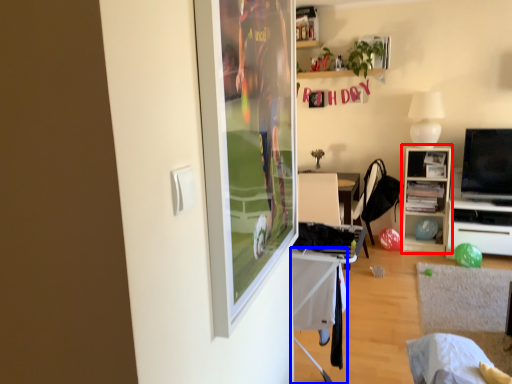
Question: Which of the following is the farthest to the observer, cabinetry (highlighted by a red box) or table (highlighted by a blue box)?

Choices:
 (A) cabinetry
 (B) table

Answer: (A)